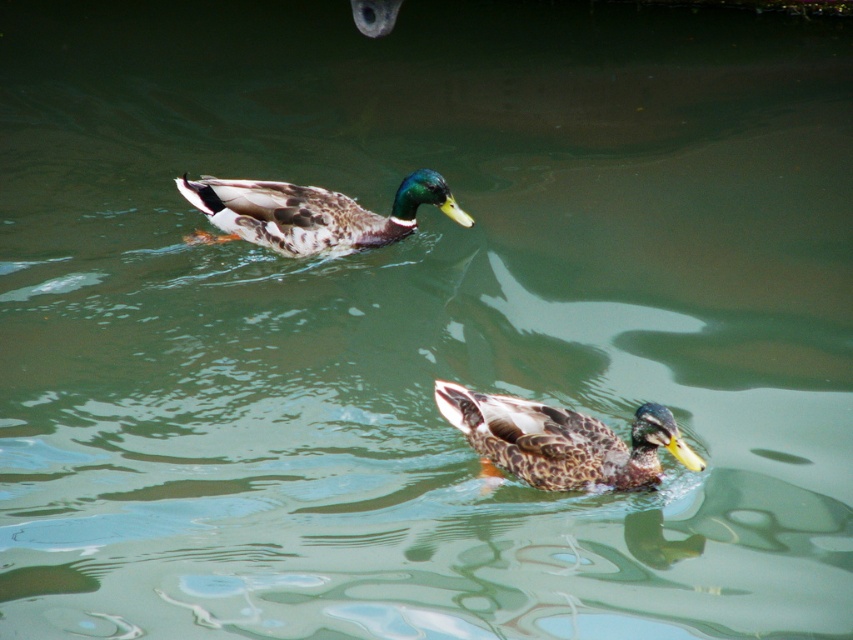
You are a photographer trying to capture a photo of both the speckled brown duck at center and the speckled feathered duck at upper center. Which duck is positioned lower in the frame?

The speckled brown duck at center is positioned lower than the speckled feathered duck at upper center.